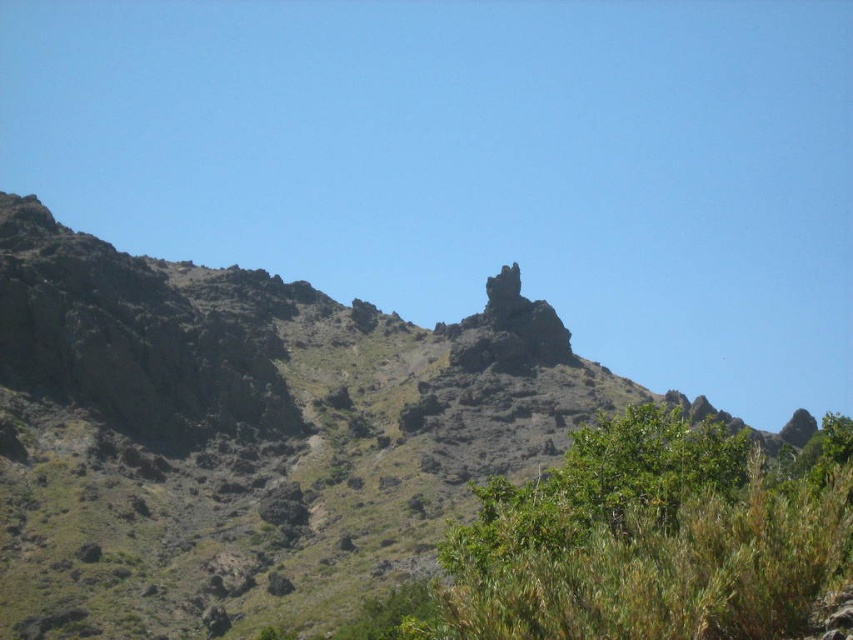
You are a hiker trying to navigate through the rugged mountainous landscape. You see the rugged rock formation at center and the green leafy shrub at center. Which object is taller and would block your view more if you were standing in front of them?

The rugged rock formation at center is much taller than the green leafy shrub at center, so it would block your view more if you were standing in front of them.

From the picture: You are a hiker planning to take a photo of the mountain landscape. You notice two points marked on your map at coordinates point (x=376, y=516) and point (x=514, y=355). Which point should you stand closer to in order to capture both points in your photo frame without moving the camera?

You should stand closer to point (x=376, y=516) because it is closer to the camera than point (x=514, y=355), so positioning yourself near it will ensure both points remain within the frame.